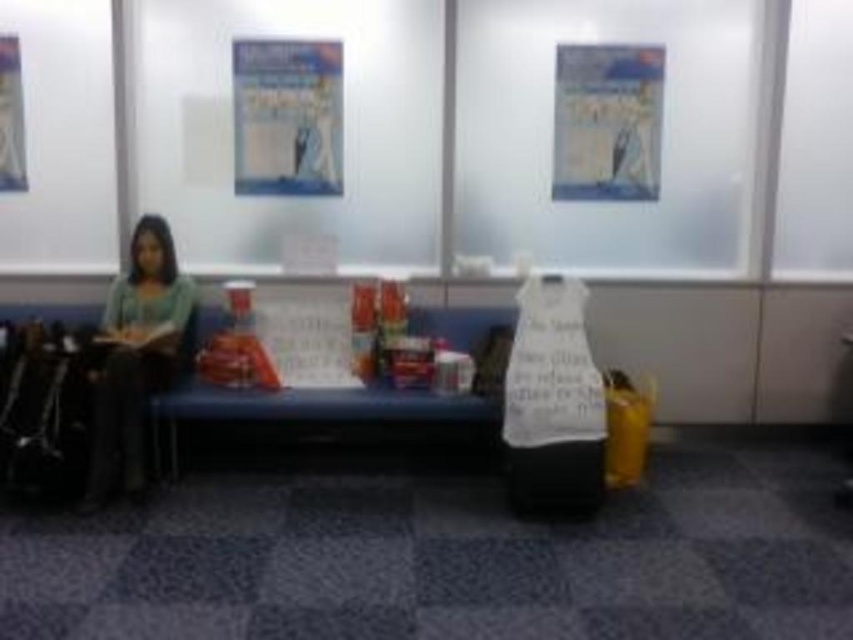
How much distance is there between blue glossy poster at upper center and metallic silver poster at upper left?

blue glossy poster at upper center is 4.24 feet away from metallic silver poster at upper left.

Is blue glossy poster at upper center to the right of metallic silver poster at upper left from the viewer's perspective?

Correct, you'll find blue glossy poster at upper center to the right of metallic silver poster at upper left.

I want to click on blue glossy poster at upper center, so click(287, 116).

Consider the image. Can you confirm if matte paper poster at upper center is thinner than metallic silver poster at upper left?

No, matte paper poster at upper center is not thinner than metallic silver poster at upper left.

Between point (630, 64) and point (9, 74), which one is positioned in front?

Point (9, 74) is in front.

This screenshot has height=640, width=853. What are the coordinates of `matte paper poster at upper center` in the screenshot? It's located at (607, 122).

Where is `matte paper poster at upper center`? matte paper poster at upper center is located at coordinates (607, 122).

Does matte green sweater at left have a smaller size compared to blue glossy poster at upper center?

Incorrect, matte green sweater at left is not smaller in size than blue glossy poster at upper center.

Does matte green sweater at left appear on the right side of blue glossy poster at upper center?

No, matte green sweater at left is not to the right of blue glossy poster at upper center.

Who is more forward, (x=109, y=477) or (x=276, y=182)?

Point (x=109, y=477) is more forward.

At what (x,y) coordinates should I click in order to perform the action: click on matte green sweater at left. Please return your answer as a coordinate pair (x, y). Looking at the image, I should click on (135, 355).